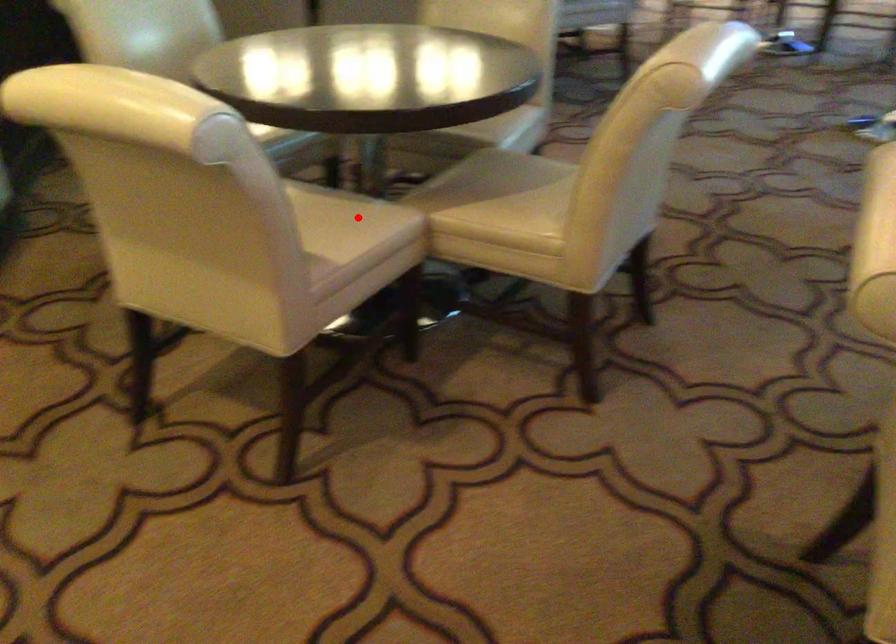
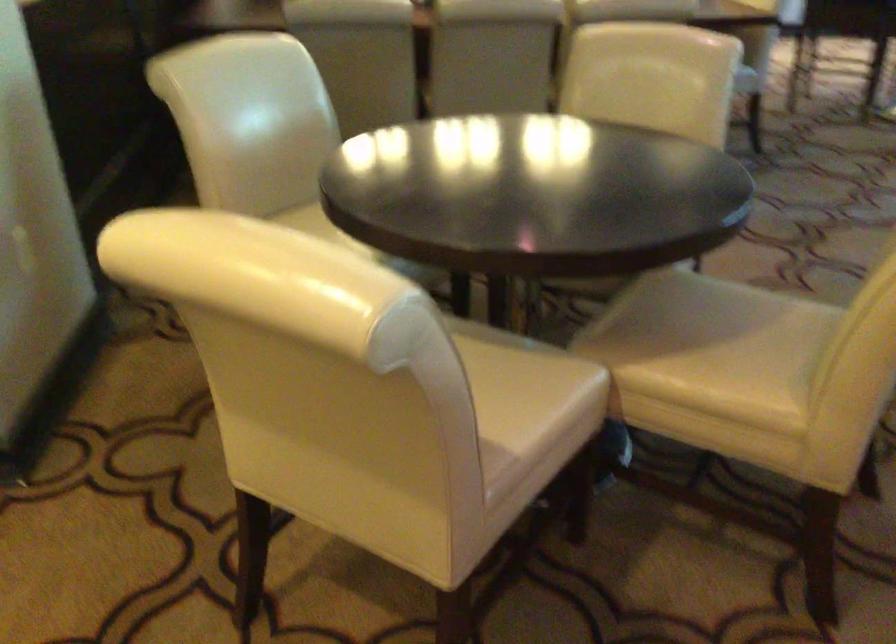
Question: I am providing you with two images of the same scene from different viewpoints. A red point is marked on the first image. At the location where the point appears in image 1, is it still visible in image 2?

Choices:
 (A) Yes
 (B) No

Answer: (A)